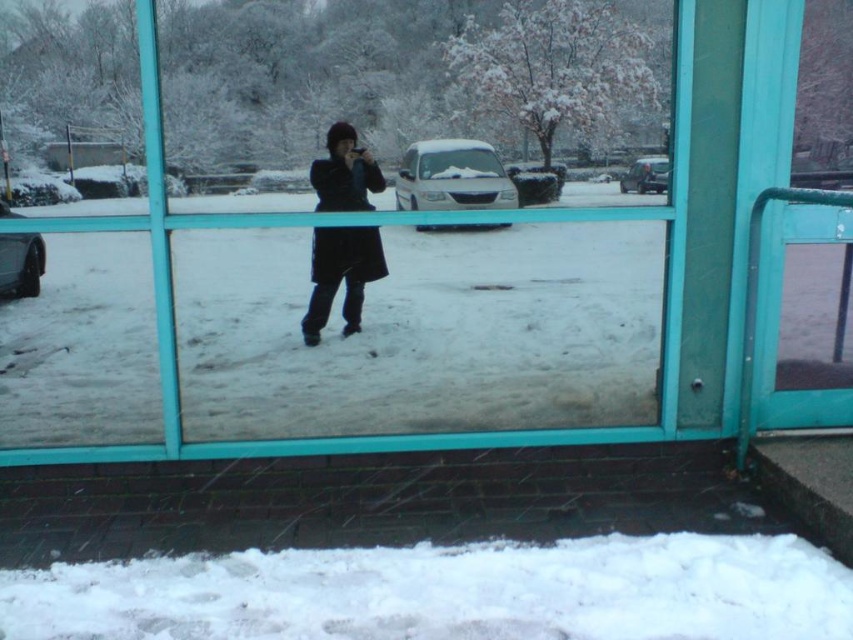
You are standing inside a house and looking through the window. You see the white fluffy snow at lower center and the black matte coat at center. Which object is closer to the window?

The white fluffy snow at lower center is closer to the window because it is positioned under the black matte coat at center, meaning it is in front of the coat in the scene.

You are standing inside a room and want to take a photo of the person outside through the clear glass window at center. Since the window is at a specific location, where exactly should you position yourself to ensure the person outside is fully visible in your shot?

The clear glass window at center is located at point (352, 257), so you should position yourself directly in front of this coordinate to ensure the person outside is fully visible through the clear glass window at center.